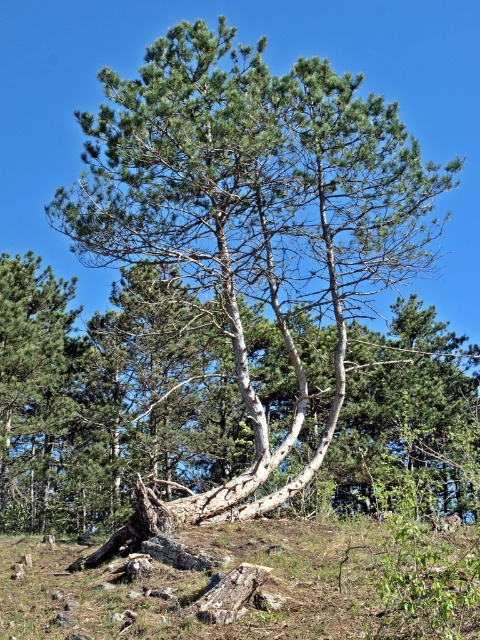
You are standing at the origin point in the scene. Which direction should you move to reach the smooth white bark tree at center?

The smooth white bark tree at center is located at point 0.353 on the x and 0.527 on the y. Since you are at the origin, you should move northeast to reach it.

You are an arborist assessing the health of trees in the image. You notice two trees labeled as smooth white bark tree at center and smooth white tree trunk at center. Which of these two has a narrower trunk?

The smooth white bark tree at center has a lesser width compared to the smooth white tree trunk at center, so it has a narrower trunk.

Looking at this image, you are standing in a forest and want to take a photo of the smooth white bark tree at center. If your camera has a maximum focus range of 40 feet, will you be able to capture the tree clearly without moving closer?

The smooth white bark tree at center is 41.31 feet away from the camera. Since the camera can only focus up to 40 feet, you will not be able to capture the tree clearly without moving closer.